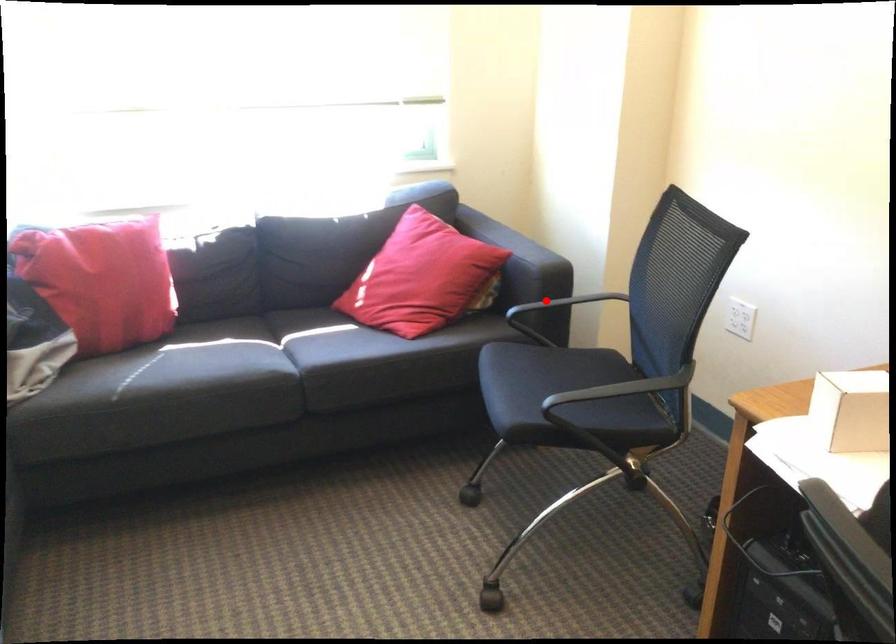
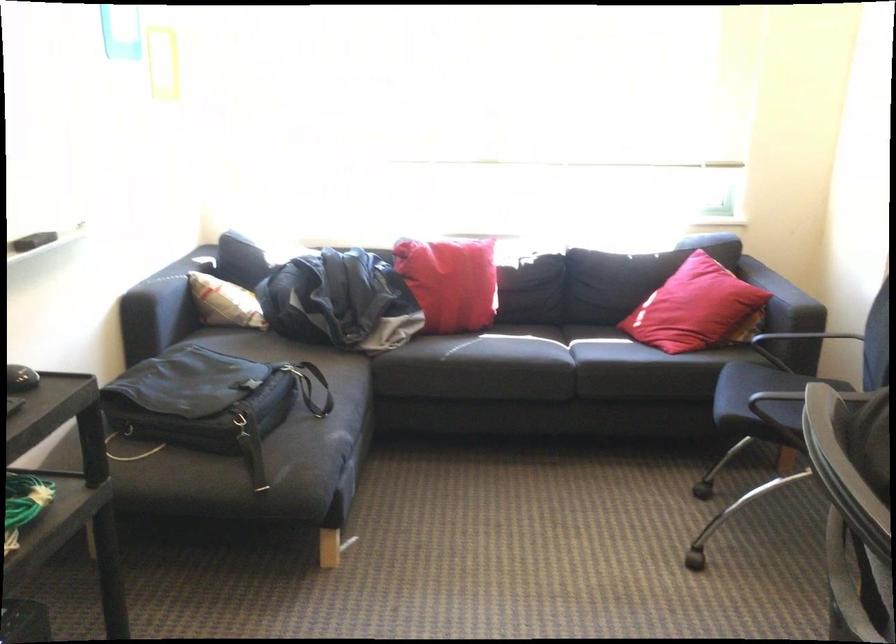
In the second image, find the point that corresponds to the highlighted location in the first image.

(802, 337)